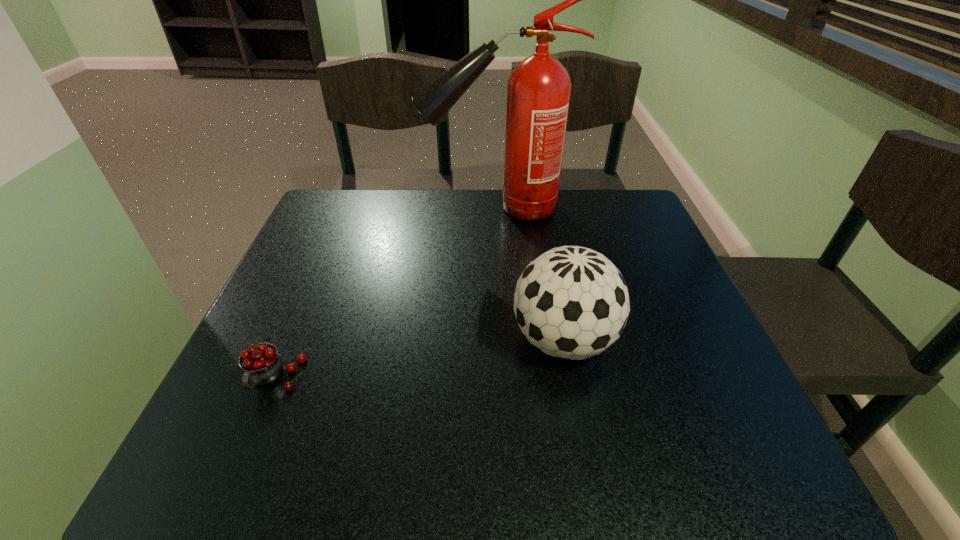
You are a GUI agent. You are given a task and a screenshot of the screen. Output one action in this format:
    pyautogui.click(x=<x>, y=<y>)
    Task: Click on the free point that satisfies the following two spatial constraints: 1. at the nozzle end of the soccer ball; 2. on the right side of the tallest object
    
    Given the screenshot: What is the action you would take?
    pyautogui.click(x=502, y=341)

Find the location of `vacant space that satisfies the following two spatial constraints: 1. at the nozzle end of the tallest object; 2. on the right side of the second shortest object`. vacant space that satisfies the following two spatial constraints: 1. at the nozzle end of the tallest object; 2. on the right side of the second shortest object is located at coordinates (502, 341).

Where is `vacant space that satisfies the following two spatial constraints: 1. at the nozzle end of the tallest object; 2. on the back side of the second shortest object`? vacant space that satisfies the following two spatial constraints: 1. at the nozzle end of the tallest object; 2. on the back side of the second shortest object is located at coordinates (502, 341).

I want to click on blank space that satisfies the following two spatial constraints: 1. at the nozzle end of the farthest object; 2. on the left side of the second tallest object, so (x=502, y=341).